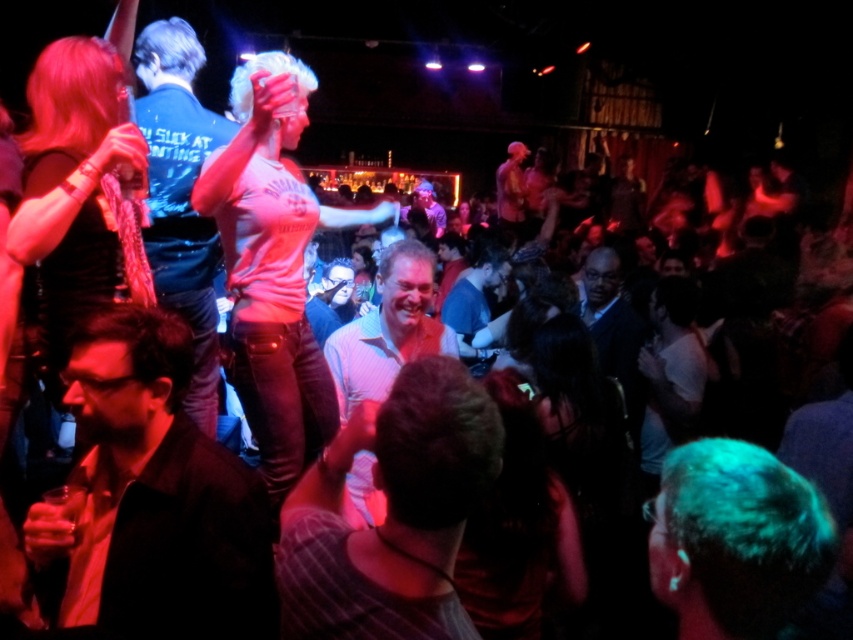
Question: Considering the real-world distances, which object is closest to the light blue striped shirt at center?

Choices:
 (A) shiny black dress at upper left
 (B) blonde synthetic wig at center

Answer: (B)

Question: Observing the image, what is the correct spatial positioning of green matte hair at lower right in reference to shiny metallic shirt at center?

Choices:
 (A) left
 (B) right

Answer: (A)

Question: Which of the following is the closest to the observer?

Choices:
 (A) (315, 429)
 (B) (409, 241)

Answer: (A)

Question: Which of these objects is positioned farthest from the pink matte shirt at center?

Choices:
 (A) dark blue denim jacket at upper left
 (B) shiny metallic shirt at center
 (C) green matte hair at lower right

Answer: (B)

Question: Is dark blue denim jacket at upper left above light blue striped shirt at center?

Choices:
 (A) yes
 (B) no

Answer: (A)

Question: Observing the image, what is the correct spatial positioning of dark brown leather jacket at lower left in reference to blonde synthetic wig at center?

Choices:
 (A) right
 (B) left

Answer: (B)